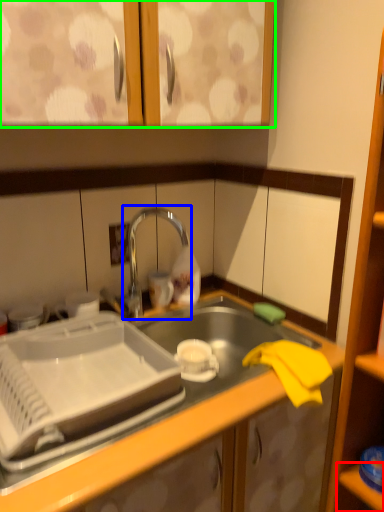
Question: Based on their relative distances, which object is farther from shelf (highlighted by a red box)? Choose from tap (highlighted by a blue box) and cabinetry (highlighted by a green box).

Choices:
 (A) tap
 (B) cabinetry

Answer: (B)